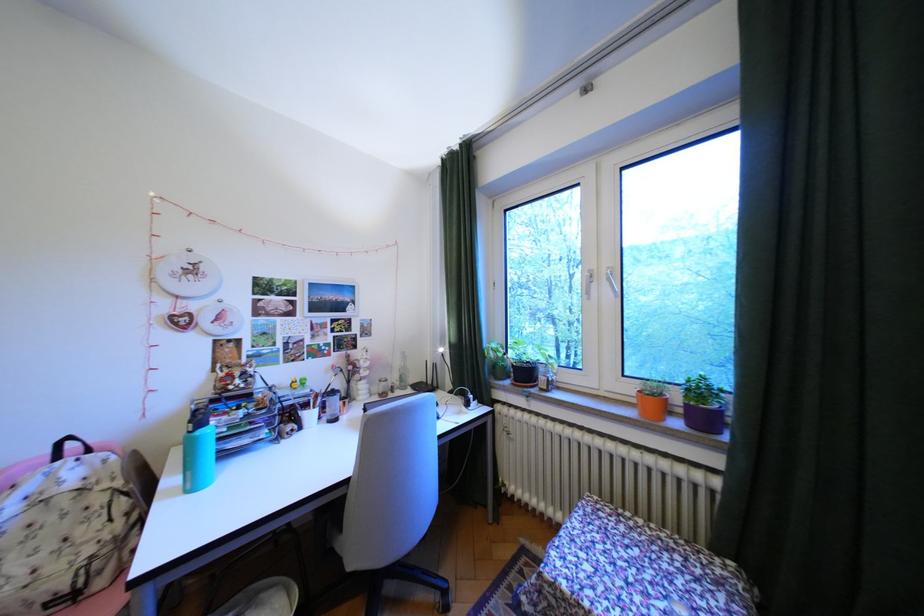
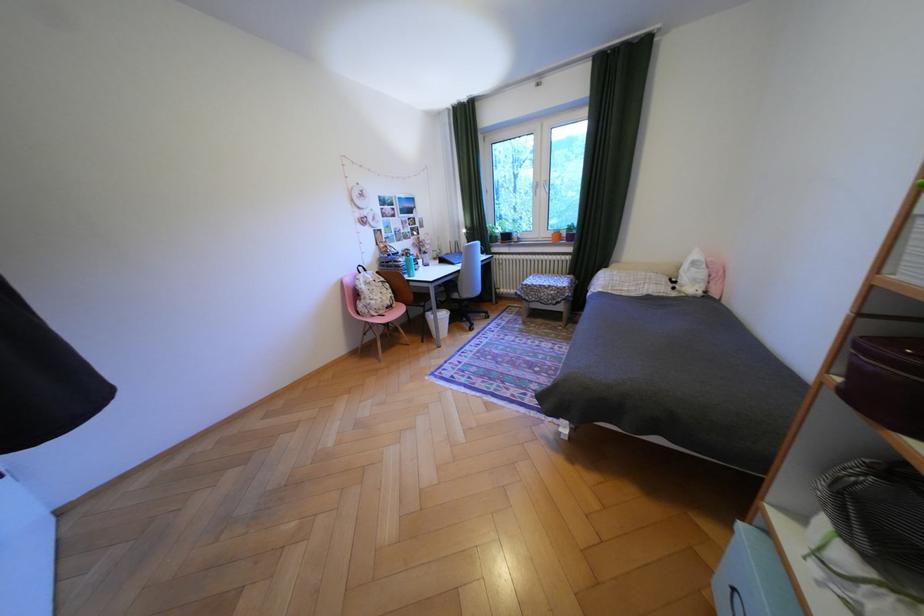
In the second image, find the point that corresponds to point (65, 519) in the first image.

(386, 288)